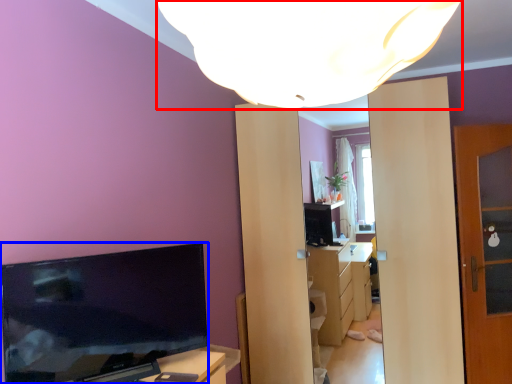
Question: Which point is closer to the camera, lamp (highlighted by a red box) or television (highlighted by a blue box)?

Choices:
 (A) lamp
 (B) television

Answer: (A)